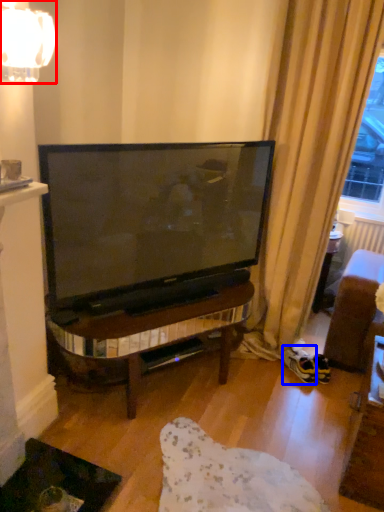
Question: Which point is further to the camera, lamp (highlighted by a red box) or footwear (highlighted by a blue box)?

Choices:
 (A) lamp
 (B) footwear

Answer: (B)